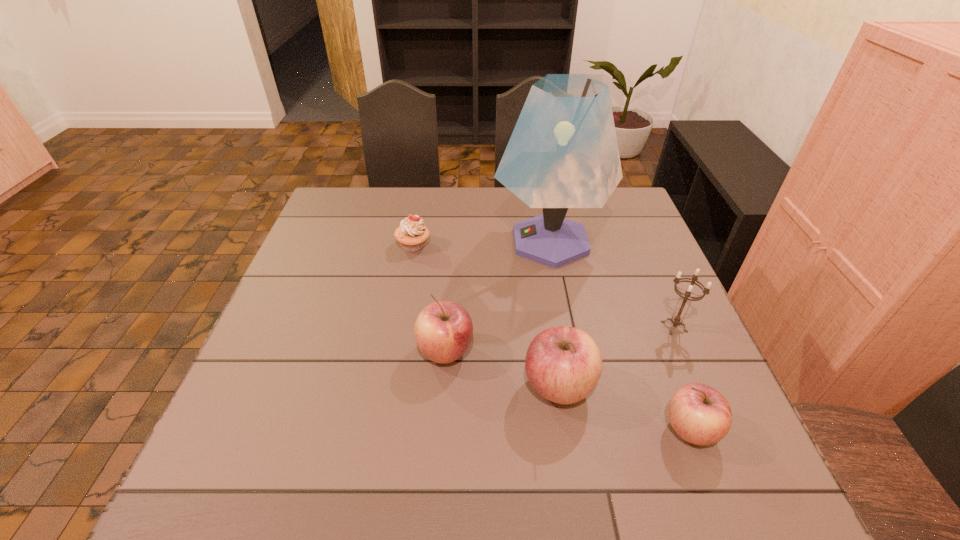
Locate an element on the screen. The height and width of the screenshot is (540, 960). empty location between the second apple from right to left and the candle holder is located at coordinates (616, 357).

Locate an element on the screen. The width and height of the screenshot is (960, 540). vacant space that is in between the leftmost apple and the lampshade is located at coordinates (498, 296).

Image resolution: width=960 pixels, height=540 pixels. In order to click on empty space that is in between the cupcake and the lampshade in this screenshot , I will do tap(482, 244).

This screenshot has height=540, width=960. What are the coordinates of `free spot between the candle holder and the leftmost object` in the screenshot? It's located at (543, 286).

Where is `free space between the rightmost apple and the candle holder`? free space between the rightmost apple and the candle holder is located at coordinates (682, 378).

Select which object is the third closest to the second apple from right to left. Please provide its 2D coordinates. Your answer should be formatted as a tuple, i.e. [(x, y)], where the tuple contains the x and y coordinates of a point satisfying the conditions above.

[(676, 320)]

Find the location of a particular element. The height and width of the screenshot is (540, 960). object that is the fourth closest to the candle holder is located at coordinates (443, 331).

Locate an element on the screen. This screenshot has width=960, height=540. apple that is the closest one to the second apple from left to right is located at coordinates (443, 331).

The image size is (960, 540). I want to click on apple that stands as the second closest to the candle holder, so click(563, 364).

Where is `vacant space that satisfies the following two spatial constraints: 1. on the base of the candle holder; 2. on the left side of the tallest object`? vacant space that satisfies the following two spatial constraints: 1. on the base of the candle holder; 2. on the left side of the tallest object is located at coordinates (566, 327).